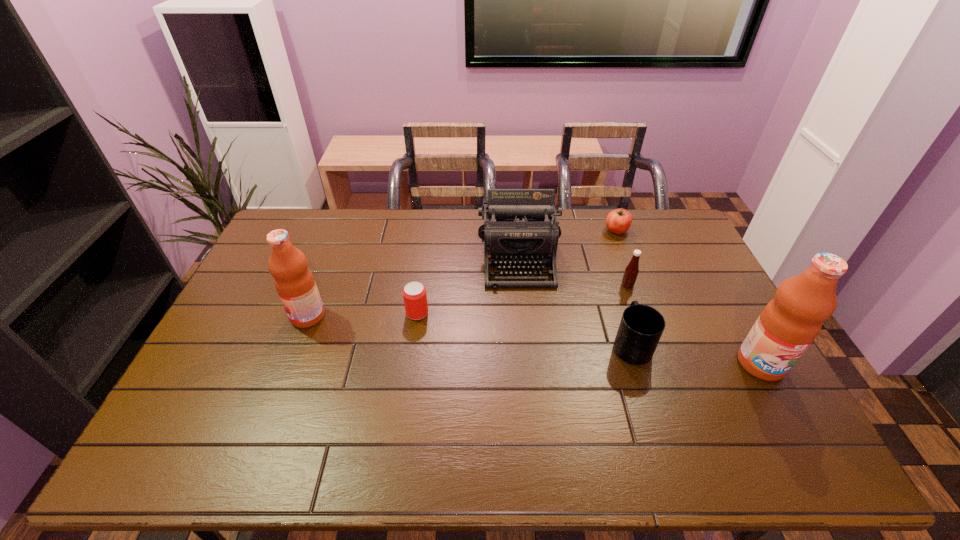
Image resolution: width=960 pixels, height=540 pixels. What are the coordinates of `free space located 0.210m on the right of the Tabasco sauce` in the screenshot? It's located at (698, 285).

Locate an element on the screen. This screenshot has height=540, width=960. apple present at the far edge is located at coordinates (618, 221).

Image resolution: width=960 pixels, height=540 pixels. Find the location of `typewriter that is at the far edge`. typewriter that is at the far edge is located at coordinates (519, 229).

The height and width of the screenshot is (540, 960). I want to click on object located at the right edge, so click(789, 323).

Where is `vacant point at the far edge`? Image resolution: width=960 pixels, height=540 pixels. vacant point at the far edge is located at coordinates (417, 221).

Image resolution: width=960 pixels, height=540 pixels. Identify the location of vacant space at the near edge of the desktop. (431, 398).

In the image, there is a desktop. Identify the location of vacant space at the left edge. This screenshot has width=960, height=540. [215, 346].

Identify the location of blank space at the right edge of the desktop. The height and width of the screenshot is (540, 960). (690, 292).

The width and height of the screenshot is (960, 540). In the image, there is a desktop. What are the coordinates of `vacant space at the far left corner` in the screenshot? It's located at (317, 231).

Locate an element on the screen. This screenshot has width=960, height=540. vacant space at the near right corner is located at coordinates (775, 408).